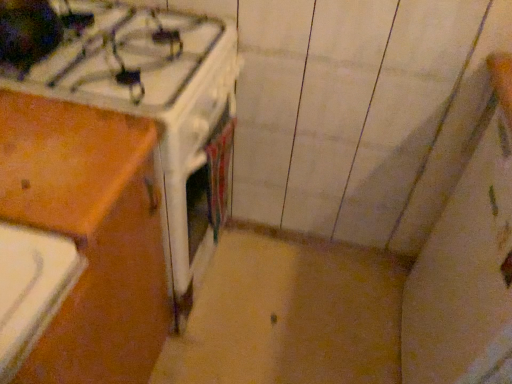
Where is `white glossy gas stove at upper left`? white glossy gas stove at upper left is located at coordinates (106, 51).

What do you see at coordinates (106, 51) in the screenshot? I see `white glossy gas stove at upper left` at bounding box center [106, 51].

Find the location of `wooden at left`. wooden at left is located at coordinates (90, 234).

This screenshot has height=384, width=512. What do you see at coordinates (90, 234) in the screenshot?
I see `wooden at left` at bounding box center [90, 234].

What are the coordinates of `white glossy gas stove at upper left` in the screenshot? It's located at (106, 51).

Can you confirm if wooden at left is positioned to the left of white glossy gas stove at upper left?

Correct, you'll find wooden at left to the left of white glossy gas stove at upper left.

Considering the relative positions of wooden at left and white glossy gas stove at upper left in the image provided, is wooden at left in front of white glossy gas stove at upper left?

Yes, the depth of wooden at left is less than that of white glossy gas stove at upper left.

Is point (60, 318) closer or farther from the camera than point (19, 24)?

Point (60, 318).

From the image's perspective, relative to white glossy gas stove at upper left, is wooden at left above or below?

Clearly, from the image's perspective, wooden at left is below white glossy gas stove at upper left.

From a real-world perspective, is wooden at left physically located above or below white glossy gas stove at upper left?

In terms of real-world spatial position, wooden at left is below white glossy gas stove at upper left.

Considering the sizes of objects wooden at left and white glossy gas stove at upper left in the image provided, who is thinner, wooden at left or white glossy gas stove at upper left?

With smaller width is wooden at left.

Who is shorter, wooden at left or white glossy gas stove at upper left?

With less height is white glossy gas stove at upper left.

Is wooden at left smaller than white glossy gas stove at upper left?

No, wooden at left is not smaller than white glossy gas stove at upper left.

Is wooden at left spatially inside white glossy gas stove at upper left, or outside of it?

wooden at left lies outside white glossy gas stove at upper left.

Is wooden at left beside white glossy gas stove at upper left?

No, wooden at left is not beside white glossy gas stove at upper left.

Is wooden at left aimed at white glossy gas stove at upper left?

No, wooden at left is not oriented towards white glossy gas stove at upper left.

Can you tell me how much wooden at left and white glossy gas stove at upper left differ in facing direction?

They differ by 0.153 degrees in their facing directions.

How much distance is there between wooden at left and white glossy gas stove at upper left?

wooden at left is 10.44 inches away from white glossy gas stove at upper left.

In the image, there is a white glossy gas stove at upper left. Where is `cabinetry below it (from the image's perspective)`? cabinetry below it (from the image's perspective) is located at coordinates (90, 234).

Considering the positions of objects white glossy gas stove at upper left and wooden at left in the image provided, who is more to the left, white glossy gas stove at upper left or wooden at left?

Positioned to the left is wooden at left.

Consider the image. Is white glossy gas stove at upper left positioned behind wooden at left?

Yes.

Considering the positions of point (196, 19) and point (101, 195), is point (196, 19) closer or farther from the camera than point (101, 195)?

Point (196, 19) is farther from the camera than point (101, 195).

From the image's perspective, is white glossy gas stove at upper left located beneath wooden at left?

No, from the image's perspective, white glossy gas stove at upper left is not beneath wooden at left.

From a real-world perspective, is white glossy gas stove at upper left positioned over wooden at left based on gravity?

Yes.

Considering the sizes of white glossy gas stove at upper left and wooden at left in the image, is white glossy gas stove at upper left wider or thinner than wooden at left?

In the image, white glossy gas stove at upper left appears to be wider than wooden at left.

Looking at this image, is white glossy gas stove at upper left shorter than wooden at left?

Yes.

Between white glossy gas stove at upper left and wooden at left, which one has smaller size?

white glossy gas stove at upper left is smaller.

Is wooden at left located within white glossy gas stove at upper left?

No, wooden at left is not a part of white glossy gas stove at upper left.

Is white glossy gas stove at upper left placed right next to wooden at left?

They are not placed beside each other.

Is white glossy gas stove at upper left facing towards wooden at left?

No, white glossy gas stove at upper left is not turned towards wooden at left.

Can you tell me how much white glossy gas stove at upper left and wooden at left differ in facing direction?

0.153 degrees separate the facing orientations of white glossy gas stove at upper left and wooden at left.

You are a GUI agent. You are given a task and a screenshot of the screen. Output one action in this format:
    pyautogui.click(x=<x>, y=<y>)
    Task: Click on the cabinetry that appears below the white glossy gas stove at upper left (from a real-world perspective)
    This screenshot has height=384, width=512.
    Given the screenshot: What is the action you would take?
    pyautogui.click(x=90, y=234)

At what (x,y) coordinates should I click in order to perform the action: click on cabinetry that is under the white glossy gas stove at upper left (from a real-world perspective). Please return your answer as a coordinate pair (x, y). Image resolution: width=512 pixels, height=384 pixels. Looking at the image, I should click on (90, 234).

You are a GUI agent. You are given a task and a screenshot of the screen. Output one action in this format:
    pyautogui.click(x=<x>, y=<y>)
    Task: Click on the cabinetry in front of the white glossy gas stove at upper left
    The height and width of the screenshot is (384, 512).
    Given the screenshot: What is the action you would take?
    pyautogui.click(x=90, y=234)